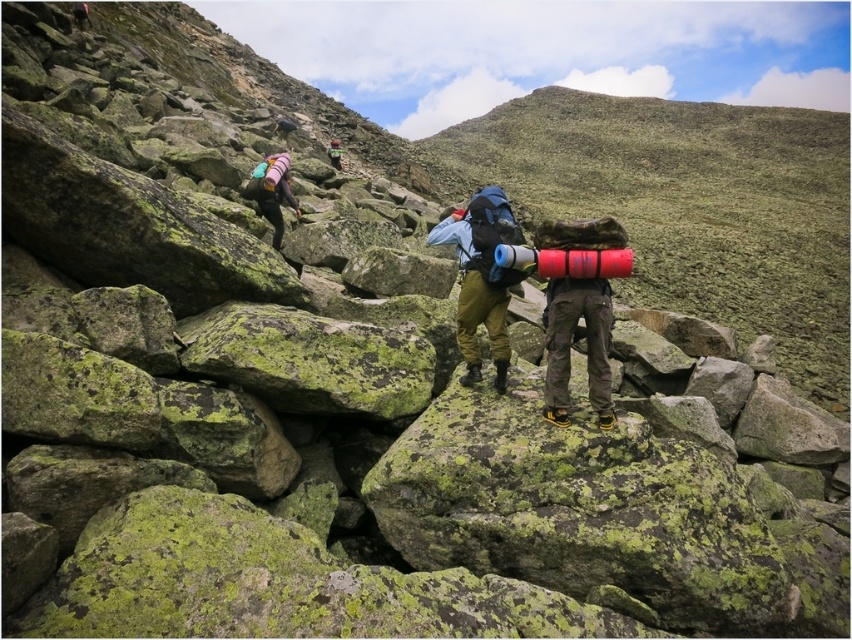
Is pink fabric backpack at upper left below matte pink backpack at upper center?

Yes, pink fabric backpack at upper left is below matte pink backpack at upper center.

Is point (269, 216) farther from viewer compared to point (332, 141)?

No, it is in front of (332, 141).

Which is in front, point (263, 205) or point (335, 166)?

Point (263, 205) is more forward.

At what (x,y) coordinates should I click in order to perform the action: click on pink fabric backpack at upper left. Please return your answer as a coordinate pair (x, y). The width and height of the screenshot is (852, 640). Looking at the image, I should click on (272, 192).

Which is in front, point (476, 282) or point (268, 164)?

Positioned in front is point (476, 282).

From the picture: Can you confirm if green camouflage pants at center is bigger than pink fabric backpack at upper left?

Actually, green camouflage pants at center might be smaller than pink fabric backpack at upper left.

Locate an element on the screen. This screenshot has width=852, height=640. green camouflage pants at center is located at coordinates [x=481, y=276].

Can you confirm if green camouflage pants at center is positioned to the right of matte pink backpack at upper center?

Indeed, green camouflage pants at center is positioned on the right side of matte pink backpack at upper center.

Identify the location of green camouflage pants at center. This screenshot has height=640, width=852. coord(481,276).

This screenshot has width=852, height=640. What are the coordinates of `green camouflage pants at center` in the screenshot? It's located at (481, 276).